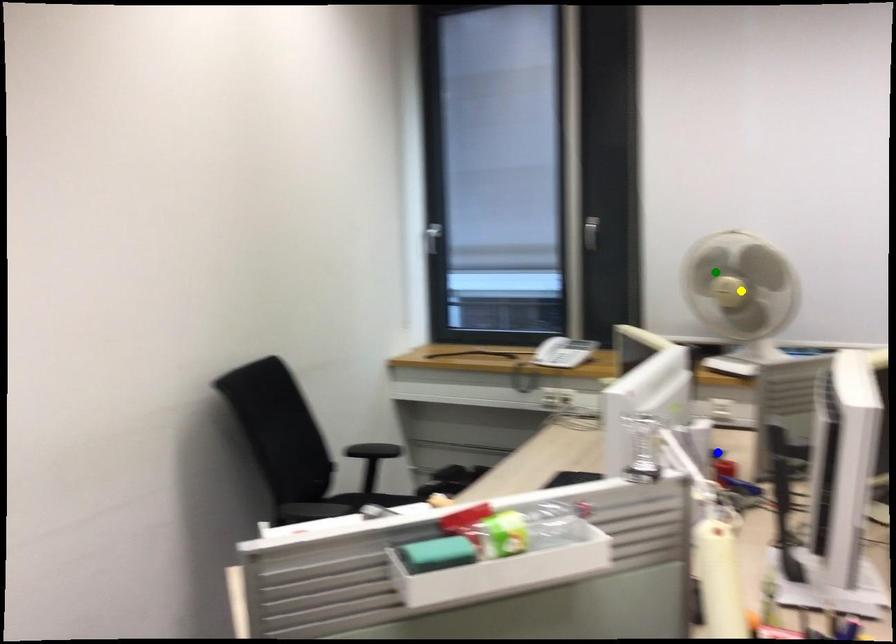
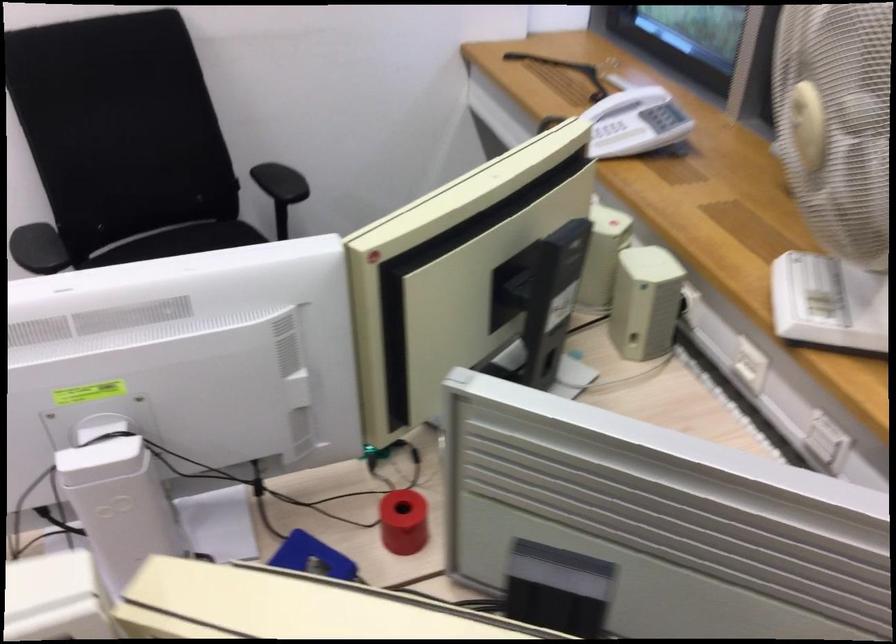
I am providing you with two images of the same scene from different viewpoints. Three points are marked in image1. Which point corresponds to a part or object that is occluded in image2?In image1, three points are marked. Which of them correspond to a part or object that is occluded in image2?Among the three points shown in image1, which one corresponds to a part or object that is no longer visible due to occlusion in image2?

yellow point cannot be seen in image2.